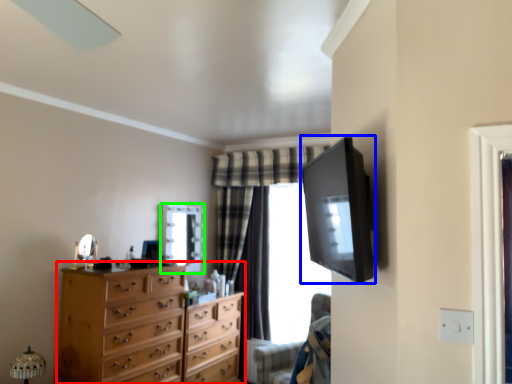
Question: Which is farther away from chest of drawers (highlighted by a red box)? television (highlighted by a blue box) or mirror (highlighted by a green box)?

Choices:
 (A) television
 (B) mirror

Answer: (A)